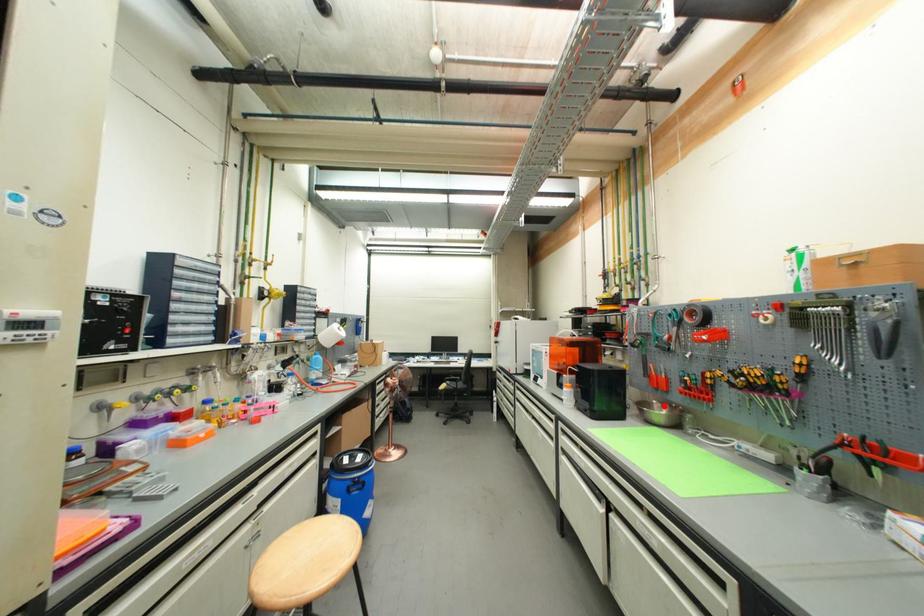
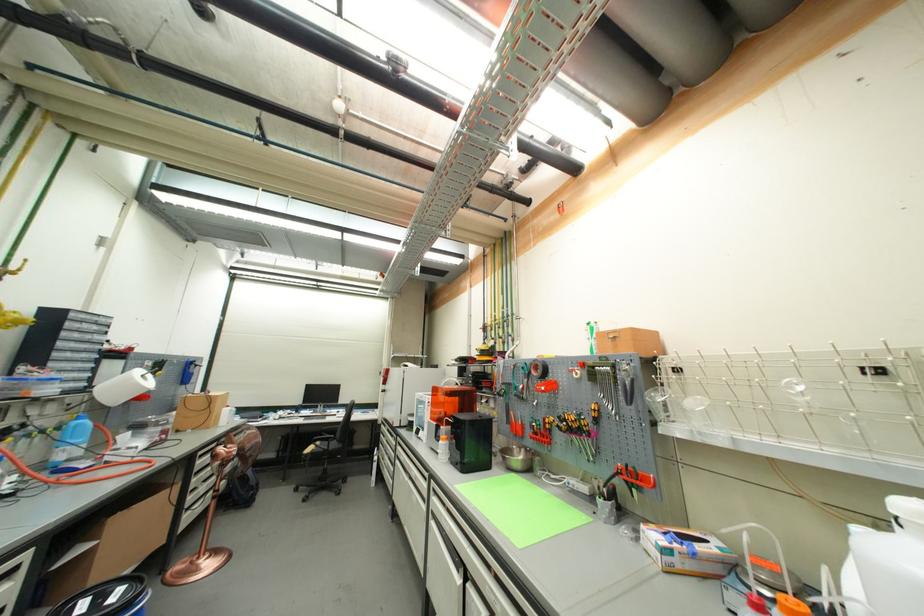
Question: I am providing you with two images of the same scene from different viewpoints. A red point is shown in image1. For the corresponding object point in image2, is it positioned nearer or farther from the camera?

Choices:
 (A) Nearer
 (B) Farther

Answer: (B)